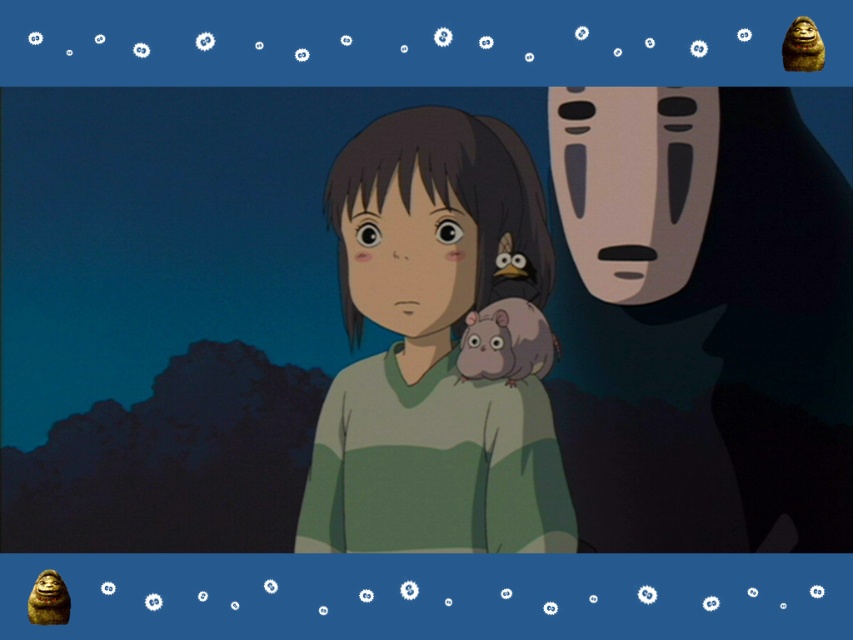
Does fuzzy gray hamster at center have a lesser height compared to brown furry monkey at upper right?

Incorrect, fuzzy gray hamster at center's height does not fall short of brown furry monkey at upper right's.

Locate an element on the screen. The height and width of the screenshot is (640, 853). fuzzy gray hamster at center is located at coordinates pos(505,342).

Describe the element at coordinates (802, 45) in the screenshot. I see `brown furry monkey at upper right` at that location.

Find the location of `brown furry monkey at upper right`. brown furry monkey at upper right is located at coordinates (802, 45).

Can you confirm if smooth green sweater at center is bigger than fuzzy gray hamster at center?

Indeed, smooth green sweater at center has a larger size compared to fuzzy gray hamster at center.

Is point (383, 550) more distant than point (486, 358)?

No.

Identify the location of smooth green sweater at center. The image size is (853, 640). (434, 348).